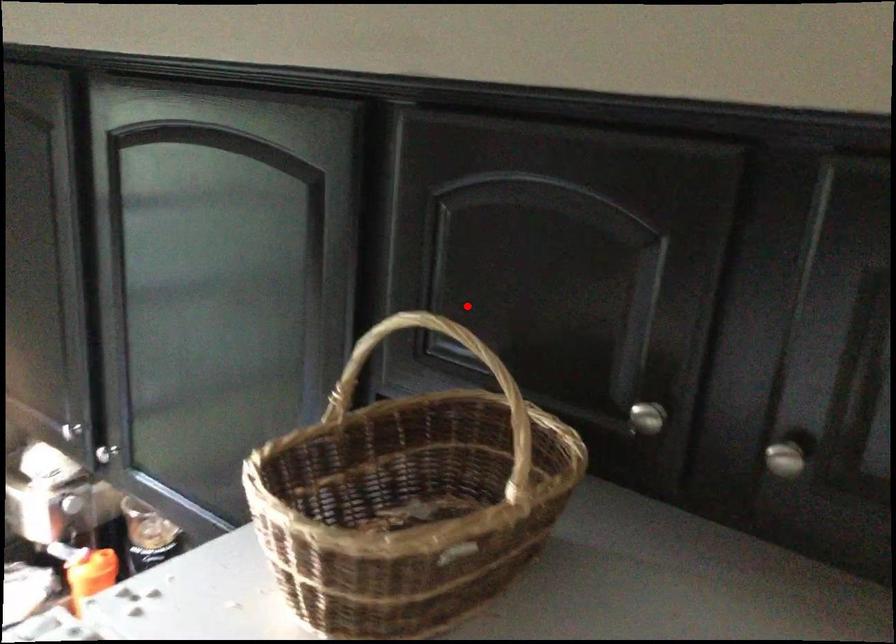
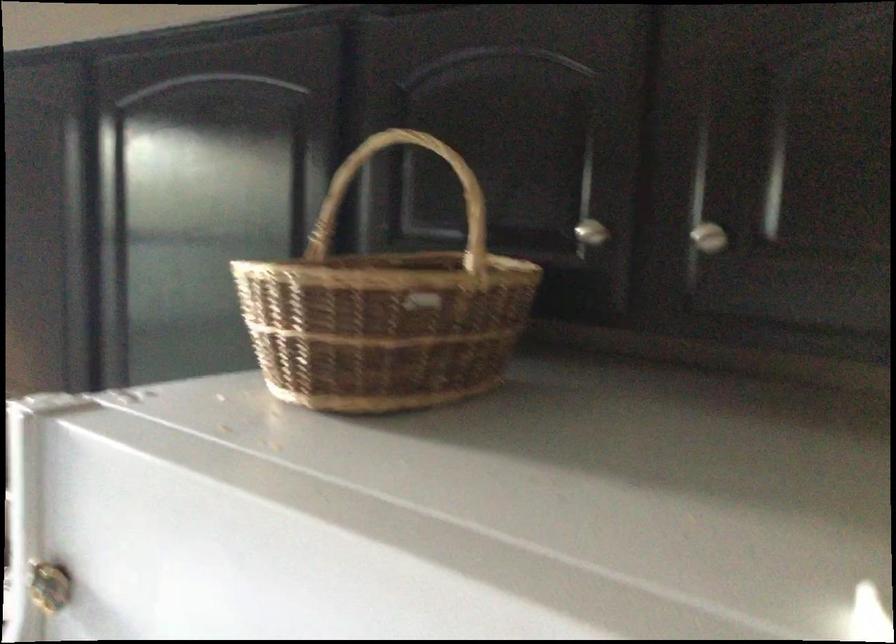
Question: I am providing you with two images of the same scene from different viewpoints. In image1, a red point is highlighted. Considering the same 3D point in image2, which of the following is correct?

Choices:
 (A) It is closer
 (B) It is farther

Answer: (B)